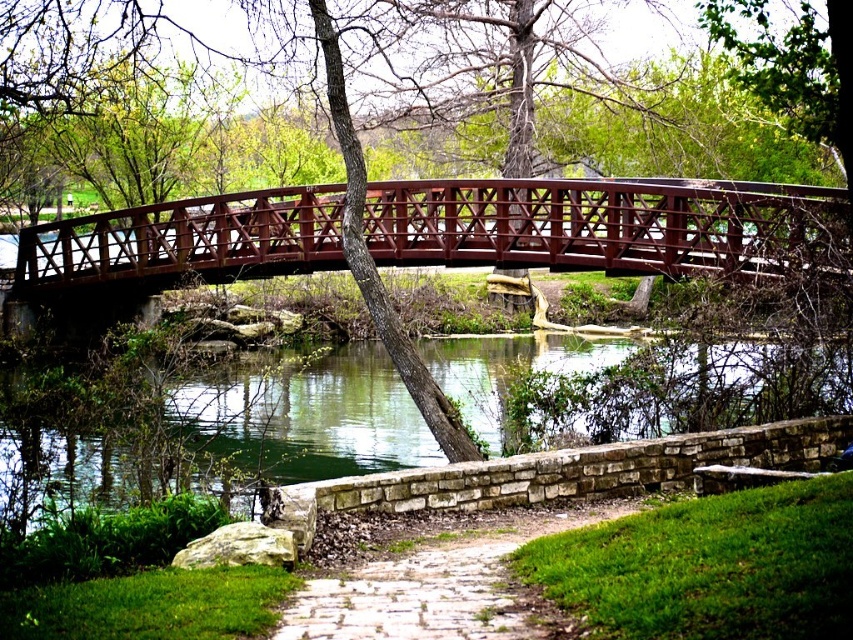
Question: Is metallic red bridge at center positioned before green water at lower center?

Choices:
 (A) yes
 (B) no

Answer: (B)

Question: Which point appears closest to the camera in this image?

Choices:
 (A) [538, 529]
 (B) [711, 227]
 (C) [326, 451]

Answer: (A)

Question: Is metallic red bridge at center thinner than white stone path at center?

Choices:
 (A) no
 (B) yes

Answer: (A)

Question: Is metallic red bridge at center behind white stone path at center?

Choices:
 (A) no
 (B) yes

Answer: (B)

Question: Among these points, which one is farthest from the camera?

Choices:
 (A) (227, 212)
 (B) (743, 365)
 (C) (305, 612)

Answer: (A)

Question: Which of the following is the closest to the observer?

Choices:
 (A) (283, 358)
 (B) (291, 636)

Answer: (B)